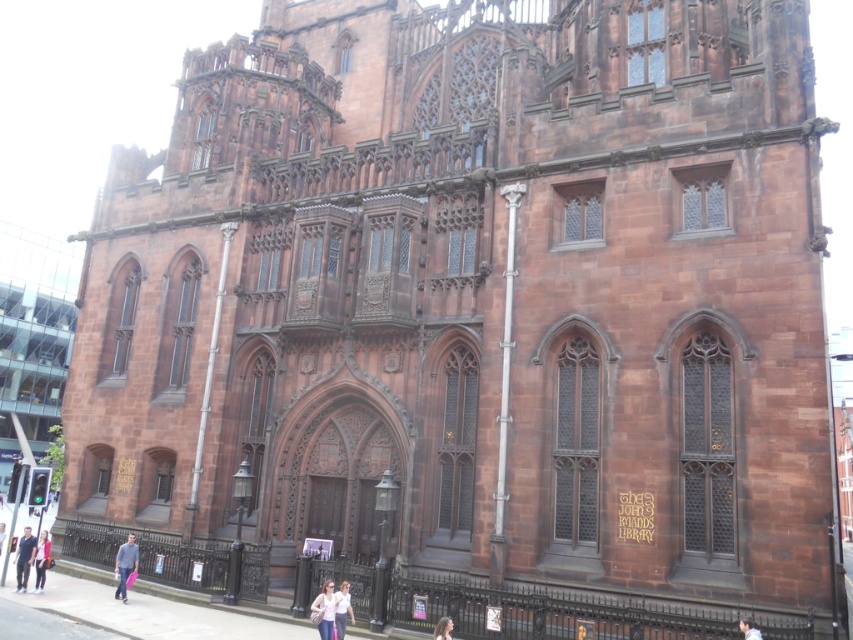
Does denim jacket at lower left appear under light blue jeans at lower left?

Incorrect, denim jacket at lower left is not positioned below light blue jeans at lower left.

Looking at this image, between denim jacket at lower left and light blue jeans at lower left, which one is positioned lower?

light blue jeans at lower left is below.

Identify the location of denim jacket at lower left. The image size is (853, 640). (125, 564).

Is point (15, 568) less distant than point (751, 628)?

That is False.

Is point (27, 536) farther from camera compared to point (747, 628)?

Yes, it is.

This screenshot has width=853, height=640. What are the coordinates of `light blue jeans at lower left` in the screenshot? It's located at (24, 557).

Does denim jacket at lower left lie behind light brown hair at center?

Yes, it is.

Does denim jacket at lower left come in front of light brown hair at center?

No, denim jacket at lower left is further to the viewer.

Measure the distance between point (123, 593) and camera.

The distance of point (123, 593) from camera is 168.79 feet.

Locate an element on the screen. denim jacket at lower left is located at coordinates (125, 564).